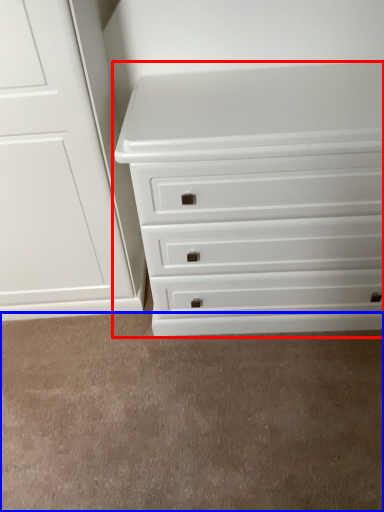
Question: Which object is further to the camera taking this photo, chest of drawers (highlighted by a red box) or plain (highlighted by a blue box)?

Choices:
 (A) chest of drawers
 (B) plain

Answer: (B)